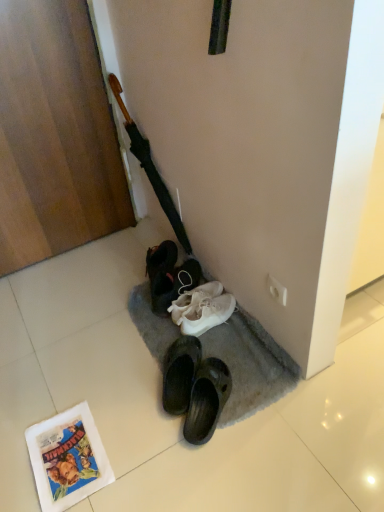
Question: Is wooden crucifix at upper left positioned behind white paper comic book at lower left?

Choices:
 (A) yes
 (B) no

Answer: (A)

Question: Considering the relative sizes of wooden crucifix at upper left and white paper comic book at lower left in the image provided, is wooden crucifix at upper left taller than white paper comic book at lower left?

Choices:
 (A) yes
 (B) no

Answer: (A)

Question: Could white paper comic book at lower left be considered to be inside wooden crucifix at upper left?

Choices:
 (A) yes
 (B) no

Answer: (B)

Question: From a real-world perspective, is wooden crucifix at upper left positioned under white paper comic book at lower left based on gravity?

Choices:
 (A) yes
 (B) no

Answer: (B)

Question: Does wooden crucifix at upper left have a lesser width compared to white paper comic book at lower left?

Choices:
 (A) no
 (B) yes

Answer: (B)

Question: Is wooden crucifix at upper left shorter than white paper comic book at lower left?

Choices:
 (A) no
 (B) yes

Answer: (A)

Question: Considering the relative positions of gray carpet at lower center and wooden crucifix at upper left in the image provided, is gray carpet at lower center to the right of wooden crucifix at upper left from the viewer's perspective?

Choices:
 (A) yes
 (B) no

Answer: (A)

Question: Is gray carpet at lower center shorter than wooden crucifix at upper left?

Choices:
 (A) yes
 (B) no

Answer: (A)

Question: Is gray carpet at lower center oriented away from wooden crucifix at upper left?

Choices:
 (A) yes
 (B) no

Answer: (B)

Question: Is gray carpet at lower center located outside wooden crucifix at upper left?

Choices:
 (A) no
 (B) yes

Answer: (B)

Question: Does gray carpet at lower center have a greater width compared to wooden crucifix at upper left?

Choices:
 (A) yes
 (B) no

Answer: (A)

Question: From the image's perspective, is gray carpet at lower center below wooden crucifix at upper left?

Choices:
 (A) yes
 (B) no

Answer: (A)

Question: Is white fabric shoe at lower center far from gray carpet at lower center?

Choices:
 (A) yes
 (B) no

Answer: (B)